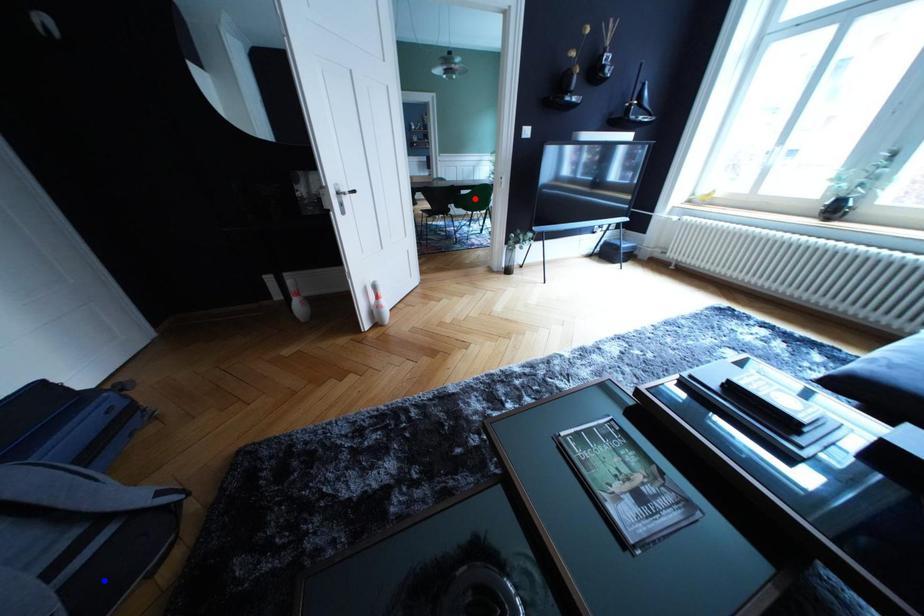
Question: Which of the two points in the image is closer to the camera?

Choices:
 (A) Blue point is closer.
 (B) Red point is closer.

Answer: (A)